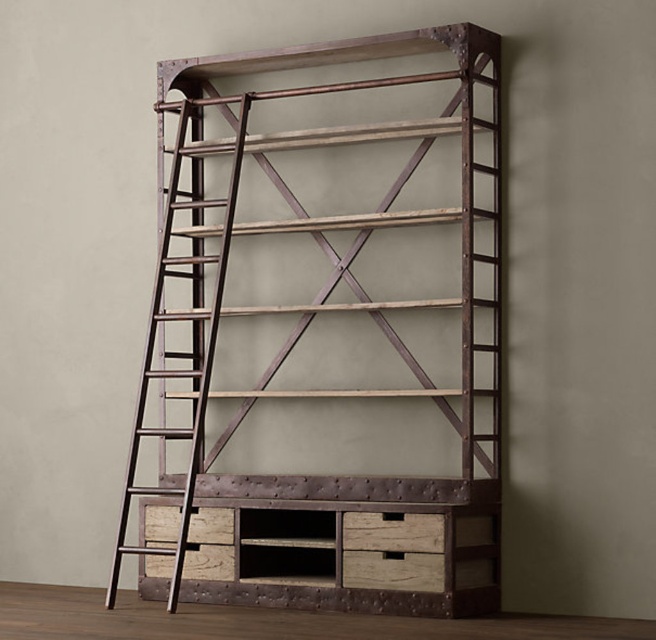
Can you confirm if rustic wood crate at center is taller than rustic wood ladder at left?

No, rustic wood crate at center is not taller than rustic wood ladder at left.

Measure the distance from rustic wood crate at center to rustic wood ladder at left.

A distance of 31.32 inches exists between rustic wood crate at center and rustic wood ladder at left.

Which is in front, point (350, 560) or point (237, 164)?

Point (350, 560) is in front.

Locate an element on the screen. The height and width of the screenshot is (640, 656). rustic wood crate at center is located at coordinates (344, 544).

Between point (186, 349) and point (363, 522), which one is positioned behind?

The point (186, 349) is behind.

Find the location of `rustic wood bookshelf at center`. rustic wood bookshelf at center is located at coordinates (316, 330).

Is rustic wood bookshelf at center above rustic wood ladder at left?

Yes, rustic wood bookshelf at center is above rustic wood ladder at left.

The image size is (656, 640). What do you see at coordinates (316, 330) in the screenshot? I see `rustic wood bookshelf at center` at bounding box center [316, 330].

Where is `rustic wood bookshelf at center`? The width and height of the screenshot is (656, 640). rustic wood bookshelf at center is located at coordinates (316, 330).